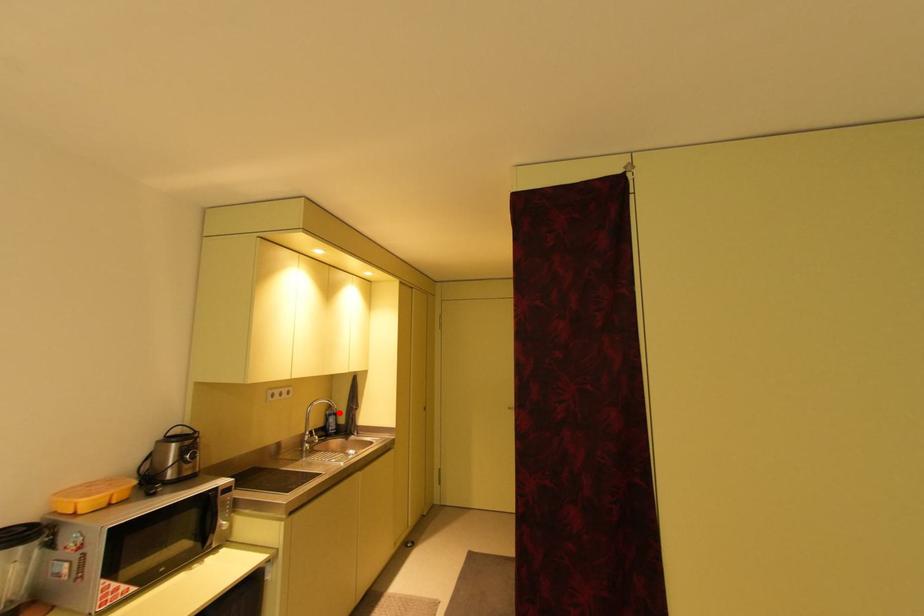
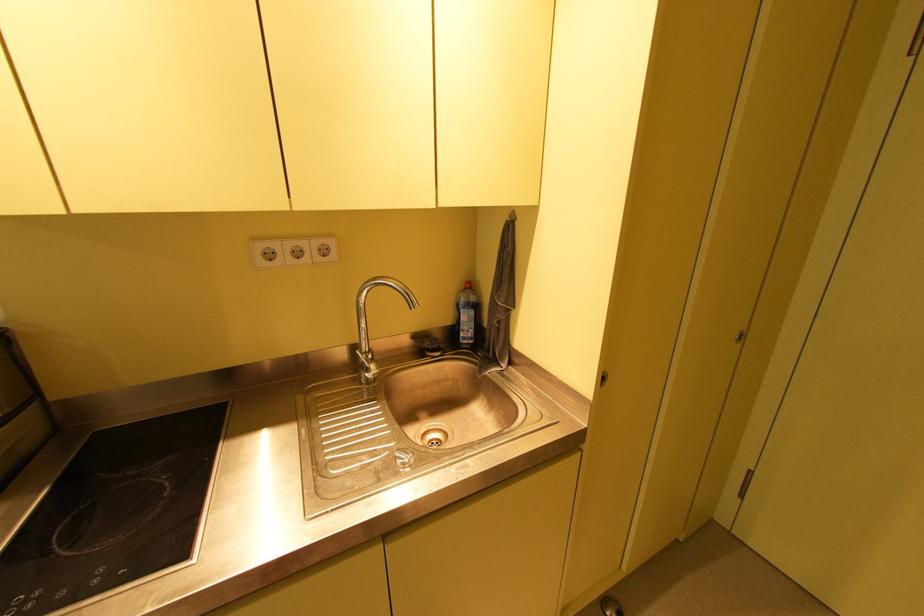
Question: I am providing you with two images of the same scene from different viewpoints. A red point is shown in image1. For the corresponding object point in image2, is it positioned nearer or farther from the camera?

Choices:
 (A) Nearer
 (B) Farther

Answer: (A)